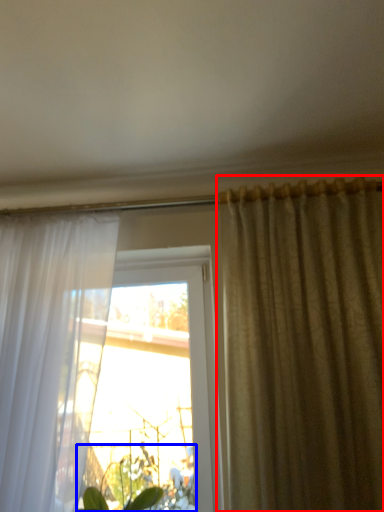
Question: Among these objects, which one is farthest to the camera, curtain (highlighted by a red box) or vegetation (highlighted by a blue box)?

Choices:
 (A) curtain
 (B) vegetation

Answer: (B)